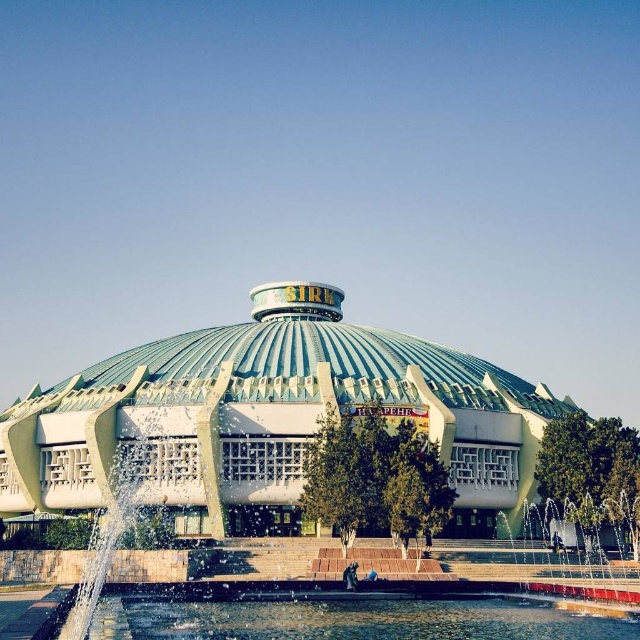
Who is lower down, green metallic dome at center or clear water at bottom?

clear water at bottom is below.

Is point (490, 490) more distant than point (173, 611)?

Yes, it is.

Does point (470, 362) lie behind point (420, 621)?

That is True.

Locate an element on the screen. green metallic dome at center is located at coordinates (269, 419).